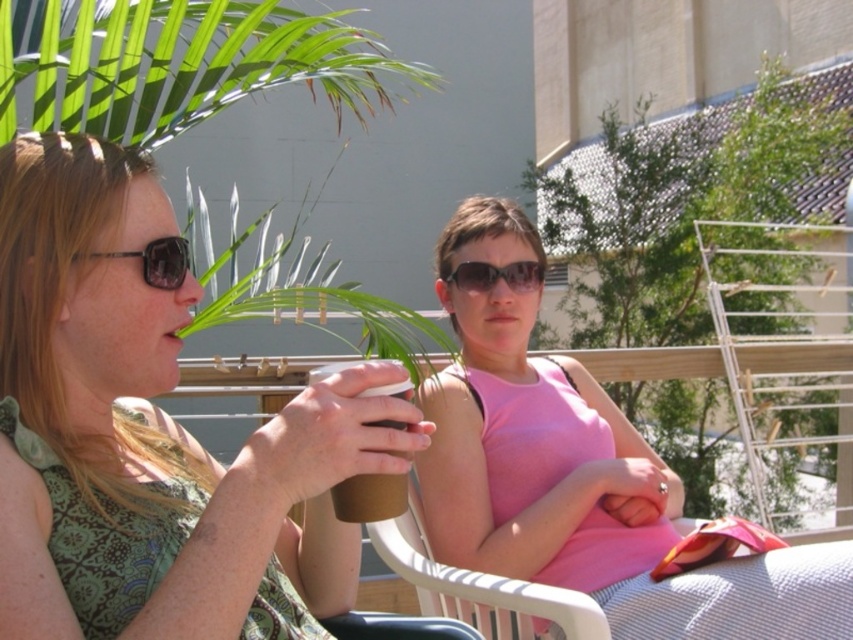
You are a photographer trying to capture a closeup of the pink fabric dress at center and the sunglasses at center. Since the camera can only focus on one object at a time, which object should you focus on first to ensure it appears larger in the photo?

The pink fabric dress at center has a greater height compared to sunglasses at center, so focusing on the pink fabric dress at center first will ensure it appears larger in the photo.

You are a fashion designer observing the scene. You need to determine which item is wider between the matte green dress at left and the sunglasses at center. Which one is wider?

The matte green dress at left is wider than the sunglasses at center, as the description states that the matte green dress at left surpasses the sunglasses at center in width.